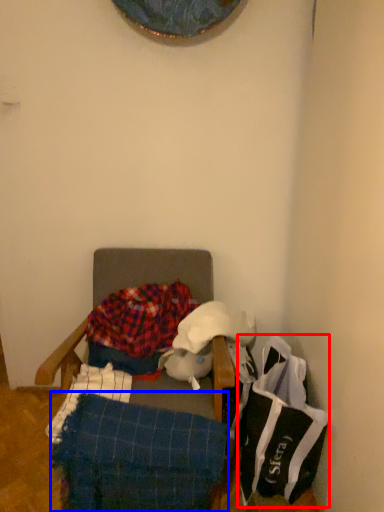
Question: Which of the following is the farthest to the observer, material (highlighted by a red box) or blanket (highlighted by a blue box)?

Choices:
 (A) material
 (B) blanket

Answer: (A)